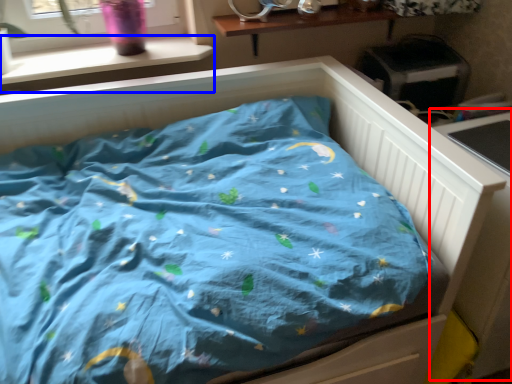
Question: Which point is further to the camera, table (highlighted by a red box) or window sill (highlighted by a blue box)?

Choices:
 (A) table
 (B) window sill

Answer: (B)